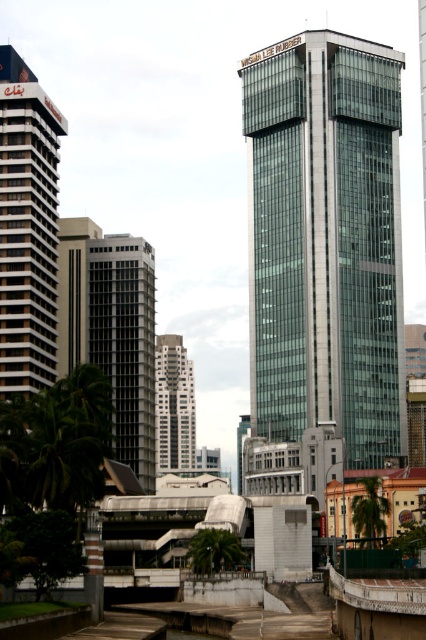
You are standing on the walkway in front of the skyscraper and want to take a photo of the white striped building at left. Which direction should you turn to face it?

The white striped building at left is located at point (26, 228), so you should turn to your left to face it.

You are an architect designing a new pathway between the white textured building at center and the green leafy palm tree at lower center. Which object has a greater width, requiring more space in your design?

The white textured building at center has a greater width than the green leafy palm tree at lower center, so it requires more space in the design.

You are standing on the walkway and want to take a photo of the white textured building at center. To avoid having the green leafy palm tree at lower center in the shot, where should you position yourself?

The white textured building at center is positioned over the green leafy palm tree at lower center, so to avoid the palm tree in your photo, you should move to a position where the building is fully visible without the palm tree obstructing it, possibly by moving to the side or adjusting your angle so that the building is framed away from the palm tree.